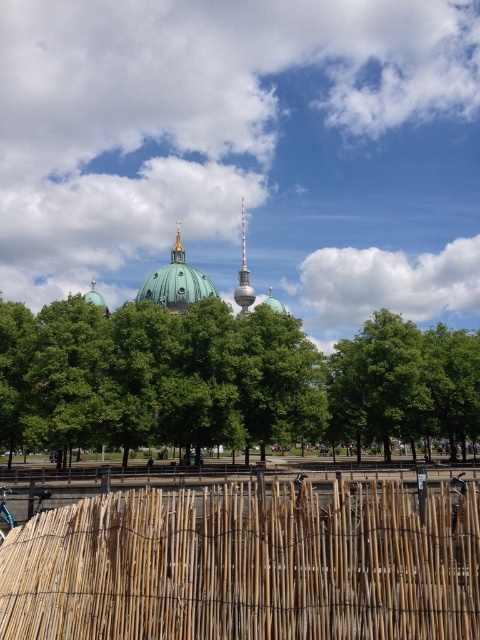
In the scene shown: You are standing at the point with coordinates point (176, 282) in the park. What object are you standing on?

The point (176, 282) corresponds to the green matte dome at center, so you are standing on the green matte dome at center.

You are standing at the point marked as point (71, 612) in the park. You want to reach the turquoise dome building in the background. The park has a rule that you must stay at least 10 feet away from any construction areas like the woven bamboo fence. Can you safely walk directly towards the turquoise dome building from your current position?

Yes, you can safely walk directly towards the turquoise dome building from point (71, 612) because the distance between them is 145.63 feet, which is well beyond the 10 feet safety requirement.